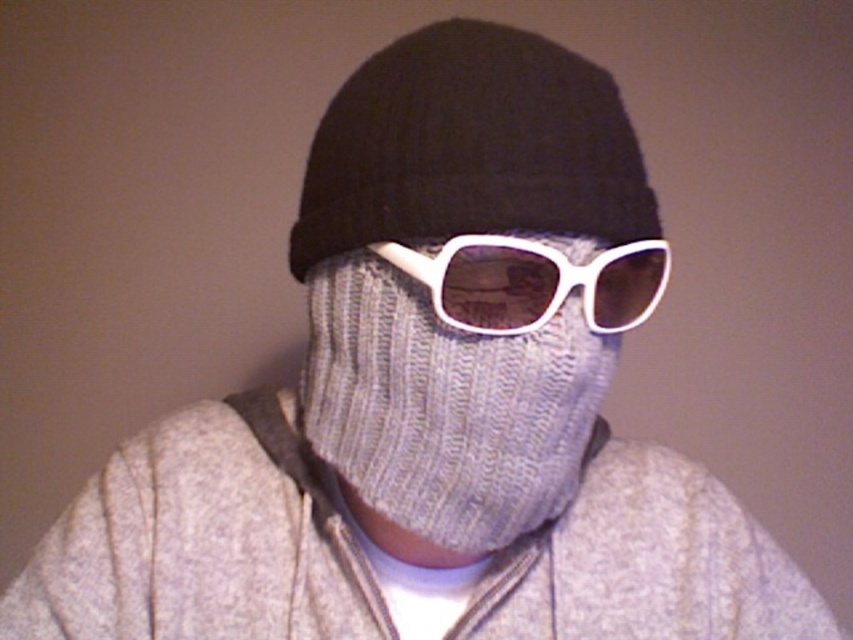
Is knitted gray mask at center below black knitted hat at center?

Correct, knitted gray mask at center is located below black knitted hat at center.

Who is more forward, (x=352, y=314) or (x=294, y=260)?

Positioned in front is point (x=352, y=314).

Locate an element on the screen. This screenshot has width=853, height=640. knitted gray mask at center is located at coordinates (445, 406).

Can you confirm if black knitted hat at center is positioned to the left of white plastic goggles at center?

Correct, you'll find black knitted hat at center to the left of white plastic goggles at center.

Find the location of a particular element. black knitted hat at center is located at coordinates (469, 147).

Between point (426, 122) and point (550, 307), which one is positioned in front?

Positioned in front is point (550, 307).

Identify the location of black knitted hat at center. The image size is (853, 640). (469, 147).

Is knitted gray mask at center thinner than white plastic goggles at center?

No.

Is point (543, 449) closer to viewer compared to point (512, 301)?

That is False.

Between point (387, 284) and point (527, 310), which one is positioned in front?

Point (527, 310) is more forward.

The height and width of the screenshot is (640, 853). I want to click on knitted gray mask at center, so click(445, 406).